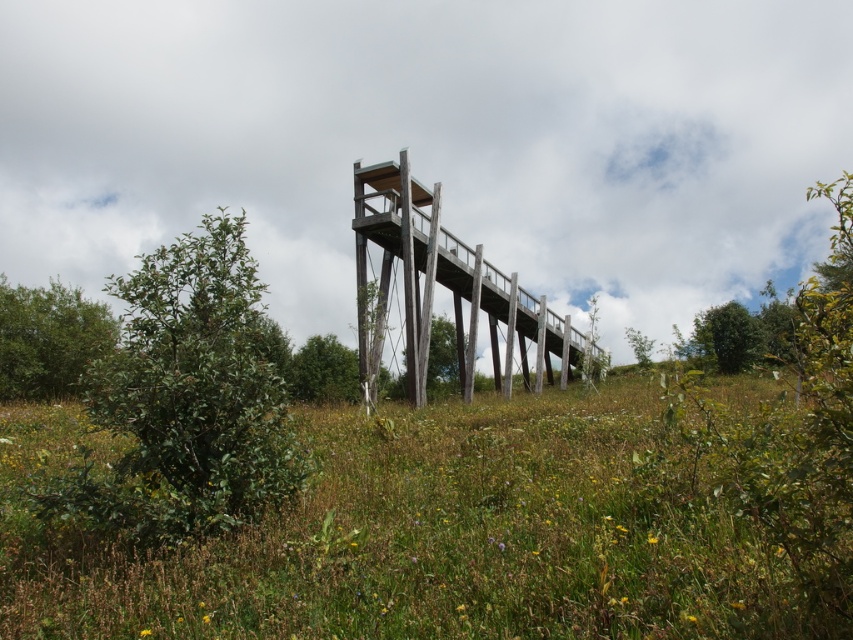
Question: Which point appears closest to the camera in this image?

Choices:
 (A) (339, 420)
 (B) (457, 369)

Answer: (A)

Question: Is green grass at center below green leafy tree at left?

Choices:
 (A) yes
 (B) no

Answer: (A)

Question: Can you confirm if green grass at center is bigger than green leafy bush at lower left?

Choices:
 (A) yes
 (B) no

Answer: (A)

Question: Is green leafy tree at left bigger than green matte tree at center?

Choices:
 (A) no
 (B) yes

Answer: (A)

Question: Which of the following is the farthest from the observer?

Choices:
 (A) (65, 356)
 (B) (398, 483)
 (C) (456, 390)
 (D) (318, 342)

Answer: (D)

Question: Which object appears farthest from the camera in this image?

Choices:
 (A) green grass at center
 (B) green leafy bush at lower left

Answer: (B)